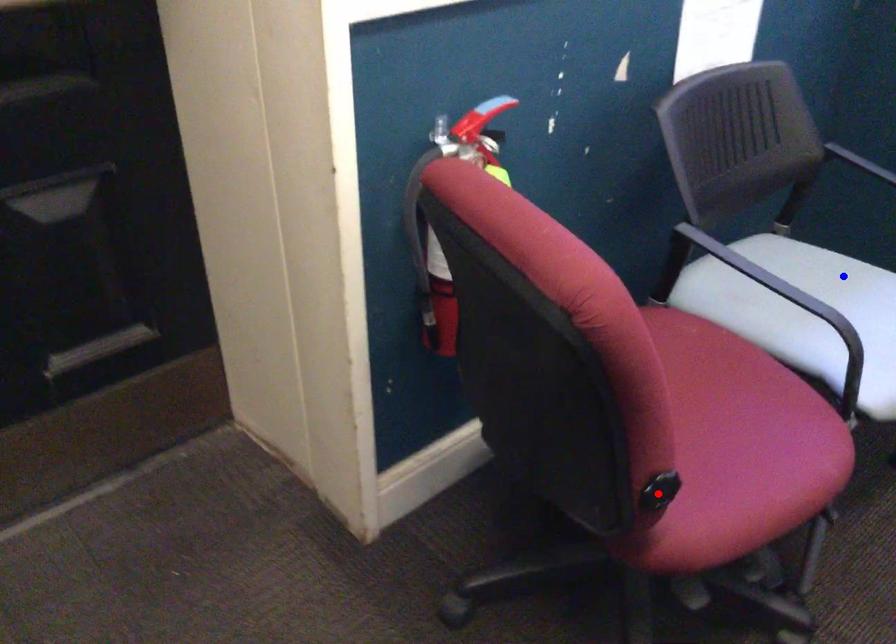
Question: Which of the two points in the image is closer to the camera?

Choices:
 (A) Blue point is closer.
 (B) Red point is closer.

Answer: (B)